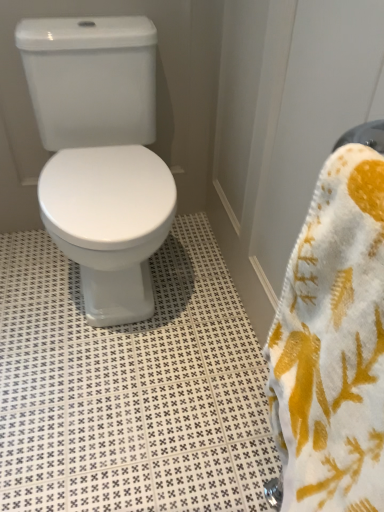
Question: Considering the relative sizes of white glossy toilet at center and white soft towel at right in the image provided, is white glossy toilet at center thinner than white soft towel at right?

Choices:
 (A) no
 (B) yes

Answer: (A)

Question: Is white glossy toilet at center completely or partially outside of white soft towel at right?

Choices:
 (A) no
 (B) yes

Answer: (B)

Question: From a real-world perspective, is white glossy toilet at center physically below white soft towel at right?

Choices:
 (A) yes
 (B) no

Answer: (A)

Question: Considering the relative positions of white glossy toilet at center and white soft towel at right in the image provided, is white glossy toilet at center to the left of white soft towel at right from the viewer's perspective?

Choices:
 (A) yes
 (B) no

Answer: (A)

Question: Is white glossy toilet at center positioned behind white soft towel at right?

Choices:
 (A) no
 (B) yes

Answer: (B)

Question: From their relative heights in the image, would you say white textured tile at center is taller or shorter than white glossy toilet at center?

Choices:
 (A) short
 (B) tall

Answer: (A)

Question: From the image's perspective, is white textured tile at center above or below white glossy toilet at center?

Choices:
 (A) below
 (B) above

Answer: (A)

Question: Is white textured tile at center spatially inside white glossy toilet at center, or outside of it?

Choices:
 (A) outside
 (B) inside

Answer: (A)

Question: Would you say white textured tile at center is to the left or to the right of white glossy toilet at center in the picture?

Choices:
 (A) left
 (B) right

Answer: (B)

Question: Is white glossy toilet at center spatially inside white soft towel at right, or outside of it?

Choices:
 (A) inside
 (B) outside

Answer: (B)

Question: From the image's perspective, relative to white soft towel at right, is white glossy toilet at center above or below?

Choices:
 (A) below
 (B) above

Answer: (B)

Question: In terms of width, does white glossy toilet at center look wider or thinner when compared to white soft towel at right?

Choices:
 (A) thin
 (B) wide

Answer: (B)

Question: Is white glossy toilet at center bigger or smaller than white soft towel at right?

Choices:
 (A) small
 (B) big

Answer: (B)

Question: From their relative heights in the image, would you say white soft towel at right is taller or shorter than white glossy toilet at center?

Choices:
 (A) short
 (B) tall

Answer: (A)

Question: Is white soft towel at right to the left or to the right of white glossy toilet at center in the image?

Choices:
 (A) right
 (B) left

Answer: (A)